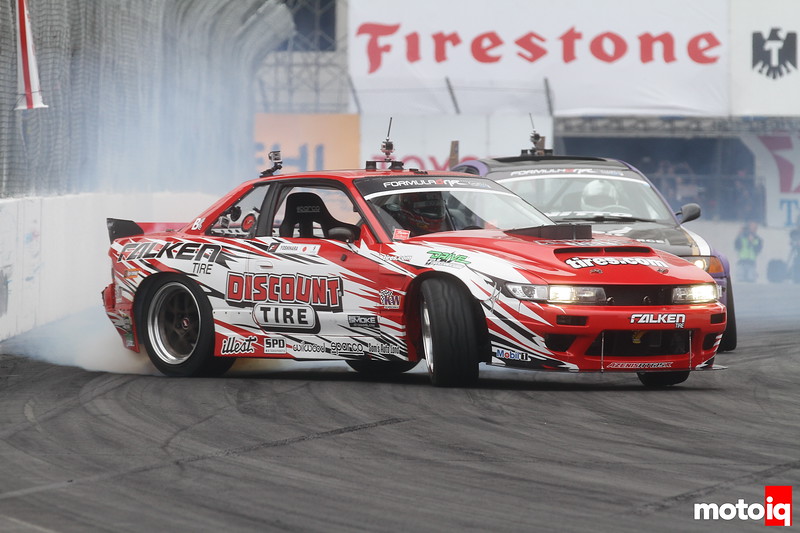
In order to click on white wall in this screenshot , I will do `click(650, 90)`.